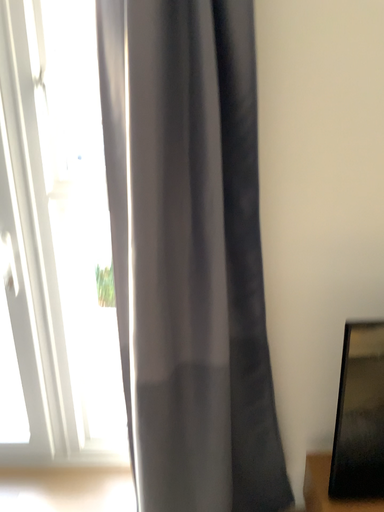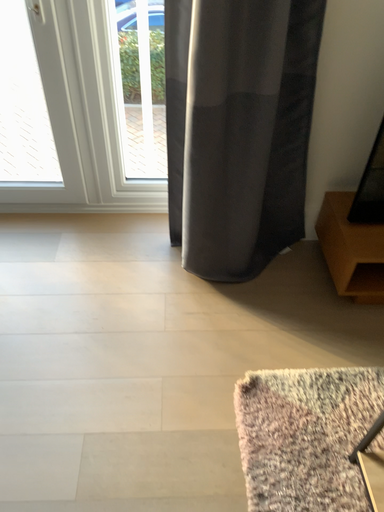
Question: How did the camera likely rotate when shooting the video?

Choices:
 (A) rotated downward
 (B) rotated upward

Answer: (A)